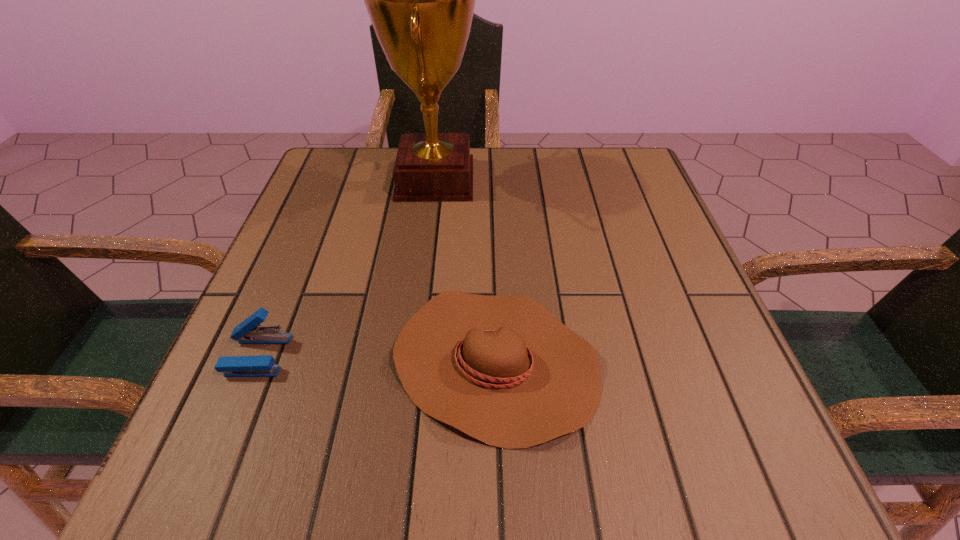
Image resolution: width=960 pixels, height=540 pixels. I want to click on blank region between the tallest object and the cowboy hat, so click(466, 271).

I want to click on vacant area between the cowboy hat and the leftmost object, so click(376, 359).

Identify the location of vacant region between the cowboy hat and the second tallest object. The width and height of the screenshot is (960, 540). (376, 359).

Identify the location of free space that is in between the second shortest object and the shortest object. This screenshot has width=960, height=540. (376, 359).

Locate an element on the screen. unoccupied area between the tallest object and the second tallest object is located at coordinates click(347, 267).

Image resolution: width=960 pixels, height=540 pixels. What are the coordinates of `vacant region between the stapler and the award` in the screenshot? It's located at (347, 267).

Where is `unoccupied area between the second shortest object and the tallest object`? Image resolution: width=960 pixels, height=540 pixels. unoccupied area between the second shortest object and the tallest object is located at coordinates (347, 267).

Locate which object is the closest to the shortest object. Please provide its 2D coordinates. Your answer should be formatted as a tuple, i.e. [(x, y)], where the tuple contains the x and y coordinates of a point satisfying the conditions above.

[(247, 332)]

Find the location of a particular element. object that is the second closest to the tallest object is located at coordinates (247, 332).

You are a GUI agent. You are given a task and a screenshot of the screen. Output one action in this format:
    pyautogui.click(x=<x>, y=<y>)
    Task: Click on the free point that satisfies the following two spatial constraints: 1. on the plaque of the award; 2. on the left side of the shortest object
    Image resolution: width=960 pixels, height=540 pixels.
    Given the screenshot: What is the action you would take?
    pyautogui.click(x=413, y=362)